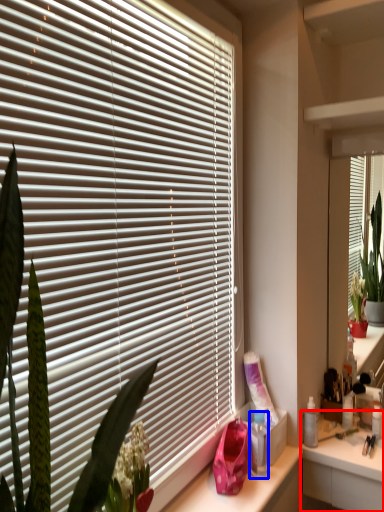
Question: Which object appears farthest to the camera in this image, counter (highlighted by a red box) or bottle (highlighted by a blue box)?

Choices:
 (A) counter
 (B) bottle

Answer: (A)